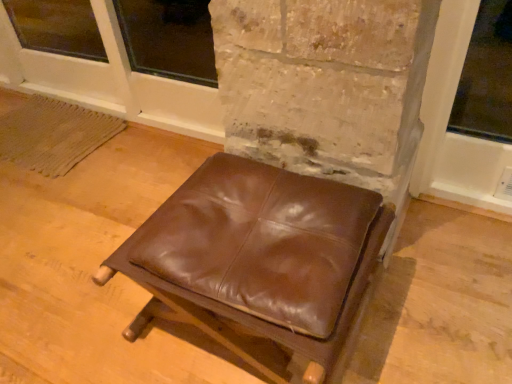
Identify the location of brown leather ottoman at center. The image size is (512, 384). (259, 261).

Describe the element at coordinates (259, 261) in the screenshot. The width and height of the screenshot is (512, 384). I see `brown leather ottoman at center` at that location.

Find the location of a particular element. brown leather ottoman at center is located at coordinates (x=259, y=261).